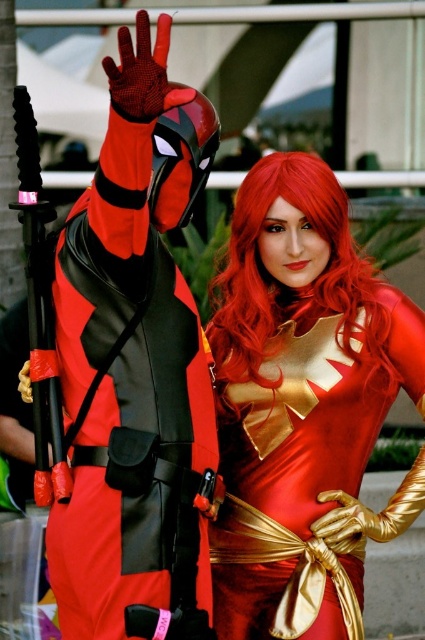
Question: Which point appears farthest from the camera in this image?

Choices:
 (A) (266, 374)
 (B) (306, 317)

Answer: (B)

Question: Can you confirm if satin gold dress at center is thinner than shiny red wig at center?

Choices:
 (A) yes
 (B) no

Answer: (B)

Question: Does satin gold dress at center have a larger size compared to shiny red wig at center?

Choices:
 (A) no
 (B) yes

Answer: (B)

Question: Is satin gold dress at center thinner than shiny red wig at center?

Choices:
 (A) no
 (B) yes

Answer: (A)

Question: Which point appears farthest from the camera in this image?

Choices:
 (A) (244, 355)
 (B) (286, 160)

Answer: (B)

Question: Which of the following is the farthest from the observer?

Choices:
 (A) satin gold dress at center
 (B) shiny red wig at center

Answer: (B)